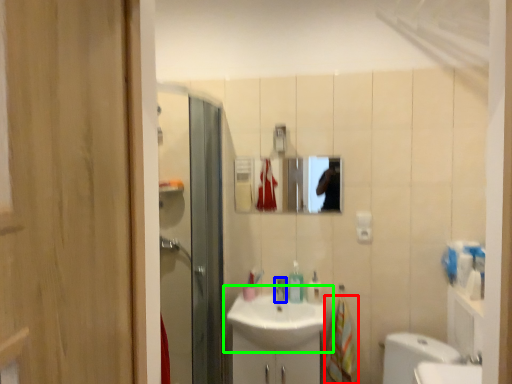
Question: Considering the real-world distances, which object is farthest from hand towel (highlighted by a red box)? tap (highlighted by a blue box) or sink (highlighted by a green box)?

Choices:
 (A) tap
 (B) sink

Answer: (A)